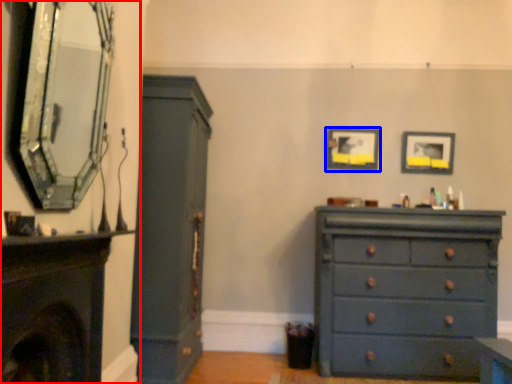
Question: Which object is closer to the camera taking this photo, fireplace (highlighted by a red box) or picture frame (highlighted by a blue box)?

Choices:
 (A) fireplace
 (B) picture frame

Answer: (A)